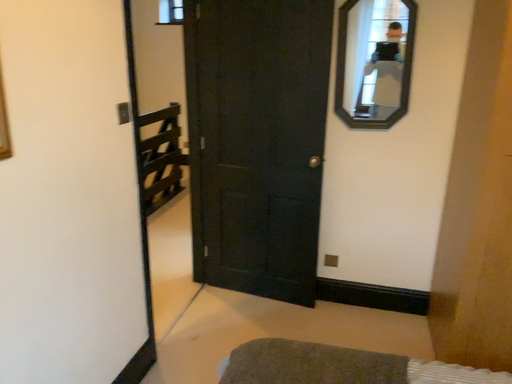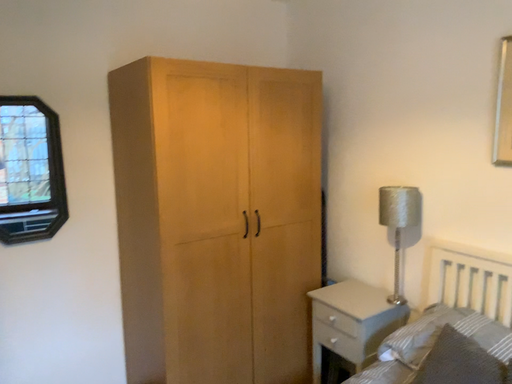
Question: Which way did the camera rotate in the video?

Choices:
 (A) rotated right
 (B) rotated left

Answer: (A)